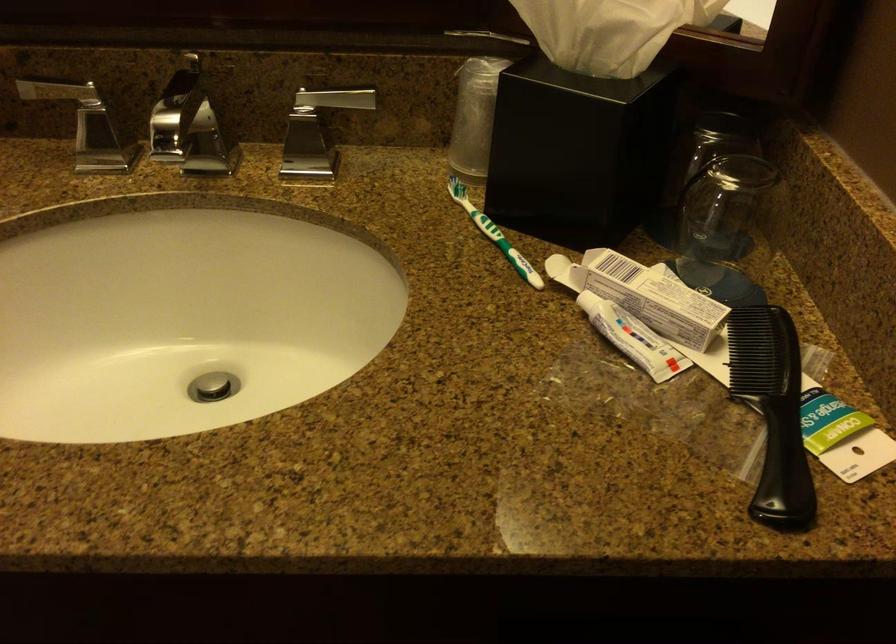
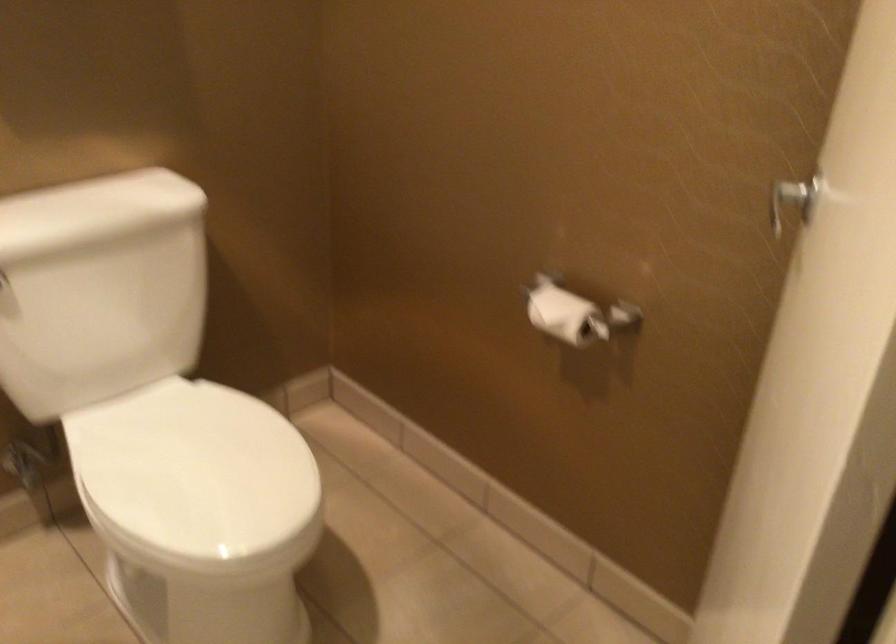
Question: How did the camera likely rotate?

Choices:
 (A) Left
 (B) Right
 (C) Up
 (D) Down

Answer: (A)